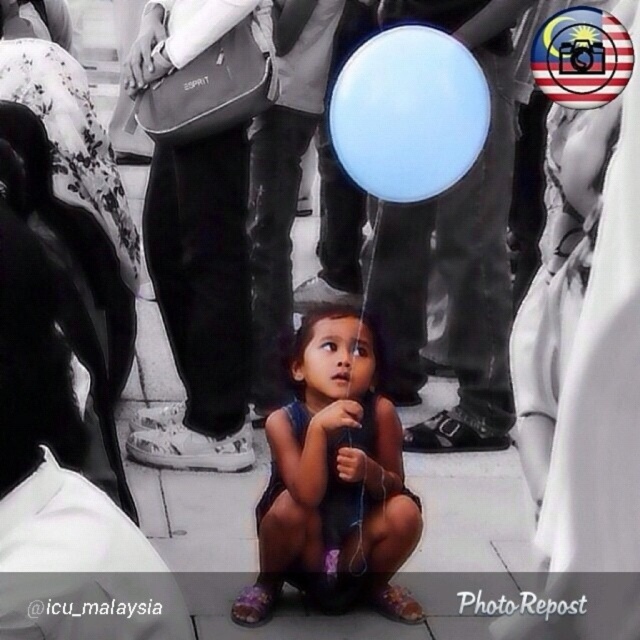
Which of these two, dark blue fabric dress at center or blue matte balloon at upper center, stands shorter?

With less height is blue matte balloon at upper center.

Between dark blue fabric dress at center and blue matte balloon at upper center, which one has more height?

dark blue fabric dress at center

Find the location of a particular element. dark blue fabric dress at center is located at coordinates (333, 477).